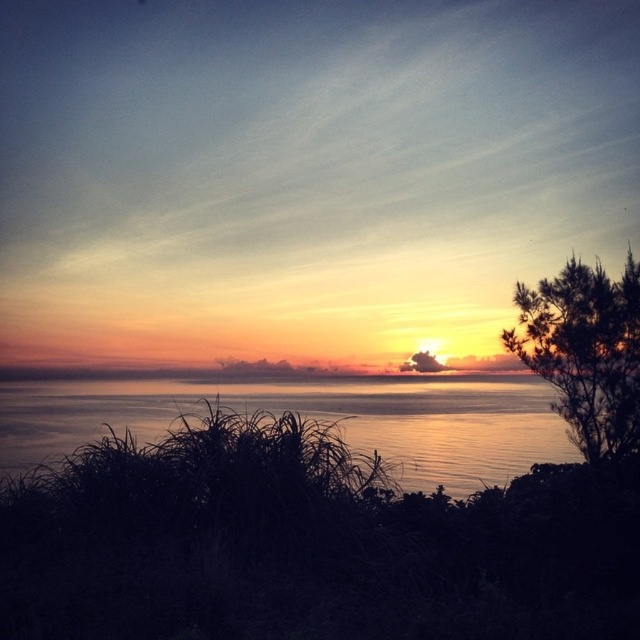
Question: Which point is farther to the camera?

Choices:
 (A) (4, 467)
 (B) (595, 317)

Answer: (B)

Question: From the image, what is the correct spatial relationship of silky water at center in relation to green needle-like leaves at right?

Choices:
 (A) right
 (B) left

Answer: (B)

Question: Considering the relative positions of silky water at center and green needle-like leaves at right in the image provided, where is silky water at center located with respect to green needle-like leaves at right?

Choices:
 (A) right
 (B) left

Answer: (B)

Question: Which point is farther to the camera?

Choices:
 (A) (588, 317)
 (B) (35, 451)

Answer: (A)

Question: Can you confirm if silky water at center is positioned to the left of green needle-like leaves at right?

Choices:
 (A) yes
 (B) no

Answer: (A)